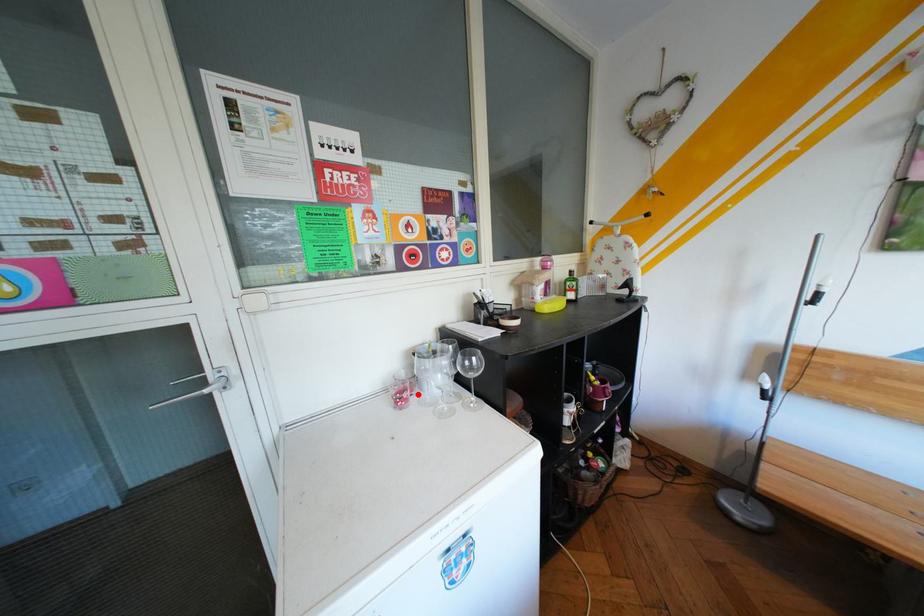
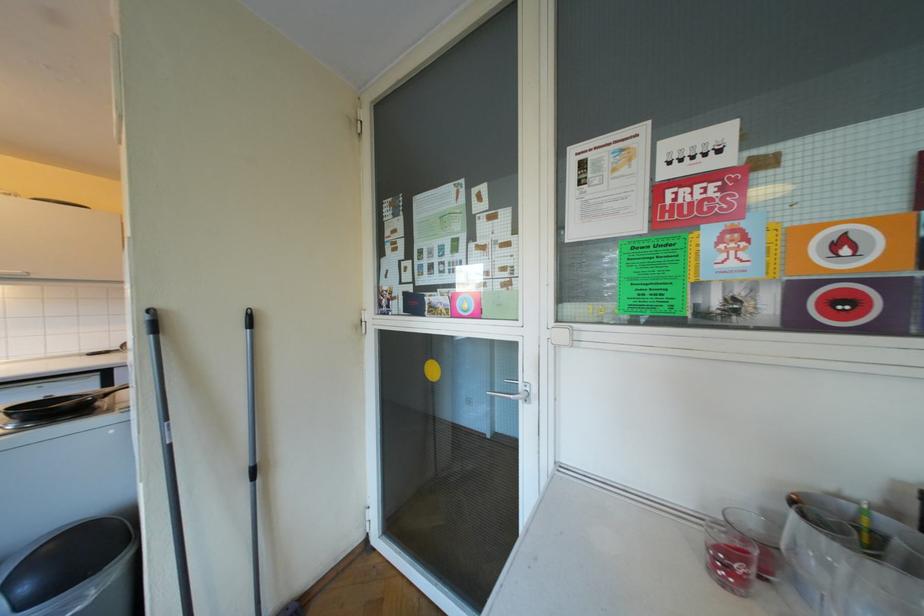
Question: I am providing you with two images of the same scene from different viewpoints. A red point is marked on the first image. Is the red point's position out of view in image 2?

Choices:
 (A) Yes
 (B) No

Answer: (B)